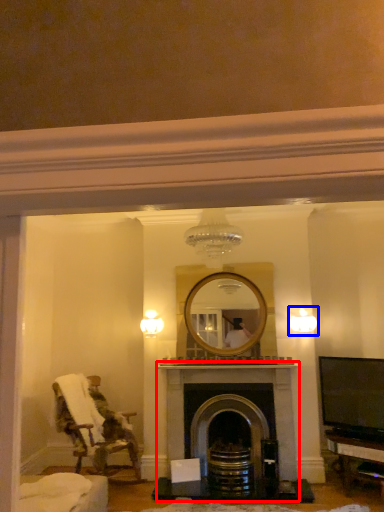
Question: Which of the following is the farthest to the observer, fireplace (highlighted by a red box) or light fixture (highlighted by a blue box)?

Choices:
 (A) fireplace
 (B) light fixture

Answer: (B)